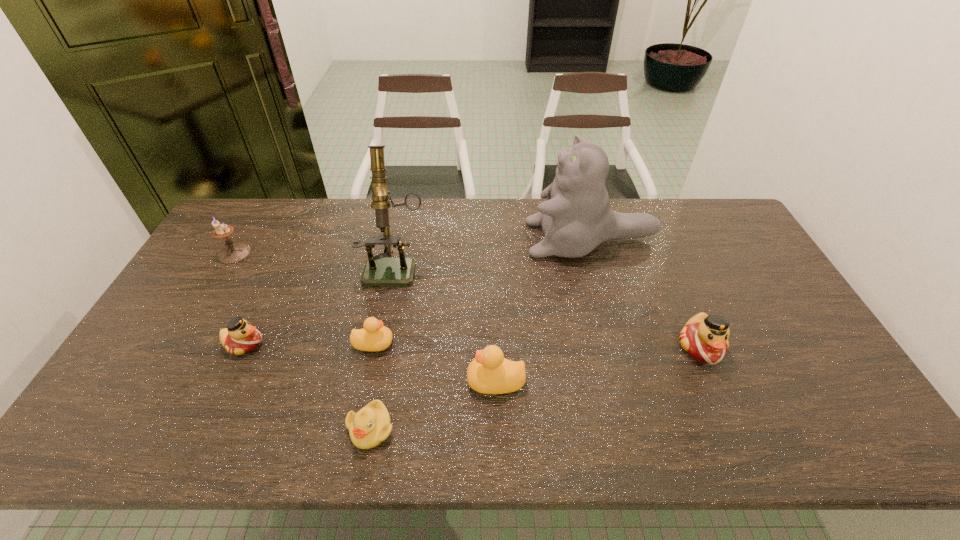
The width and height of the screenshot is (960, 540). Identify the location of free space in the image that satisfies the following two spatial constraints: 1. on the face of the right red duck; 2. on the face of the third object from right to left. coord(715,381).